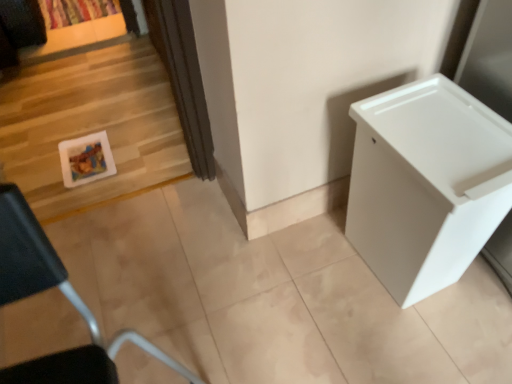
Question: Should I look upward or downward to see white plastic container at lower left?

Choices:
 (A) up
 (B) down

Answer: (B)

Question: Is the position of white plastic container at lower left more distant than that of white plastic changing table at right?

Choices:
 (A) no
 (B) yes

Answer: (A)

Question: Does white plastic container at lower left have a lesser width compared to white plastic changing table at right?

Choices:
 (A) yes
 (B) no

Answer: (A)

Question: Is white plastic container at lower left smaller than white plastic changing table at right?

Choices:
 (A) no
 (B) yes

Answer: (A)

Question: Would you say white plastic container at lower left contains white plastic changing table at right?

Choices:
 (A) no
 (B) yes

Answer: (A)

Question: Is white plastic container at lower left at the left side of white plastic changing table at right?

Choices:
 (A) no
 (B) yes

Answer: (B)

Question: Is white plastic container at lower left closer to camera compared to white plastic changing table at right?

Choices:
 (A) yes
 (B) no

Answer: (A)

Question: Is the position of white glossy picture frame at left more distant than that of white plastic container at lower left?

Choices:
 (A) yes
 (B) no

Answer: (A)

Question: Is white glossy picture frame at left facing away from white plastic container at lower left?

Choices:
 (A) no
 (B) yes

Answer: (A)

Question: Is white glossy picture frame at left to the right of white plastic container at lower left from the viewer's perspective?

Choices:
 (A) yes
 (B) no

Answer: (B)

Question: Would you say white glossy picture frame at left is outside white plastic container at lower left?

Choices:
 (A) no
 (B) yes

Answer: (B)

Question: From the image's perspective, is white glossy picture frame at left located beneath white plastic container at lower left?

Choices:
 (A) yes
 (B) no

Answer: (B)

Question: From a real-world perspective, does white glossy picture frame at left stand above white plastic container at lower left?

Choices:
 (A) yes
 (B) no

Answer: (B)

Question: Would you say white plastic changing table at right contains white glossy picture frame at left?

Choices:
 (A) no
 (B) yes

Answer: (A)